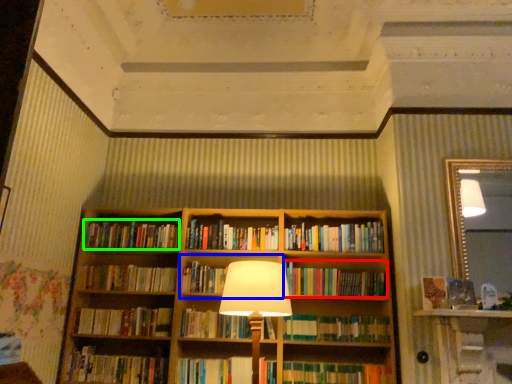
Question: Which is farther away from book (highlighted by a red box)? cabinet (highlighted by a blue box) or book (highlighted by a green box)?

Choices:
 (A) cabinet
 (B) book

Answer: (B)